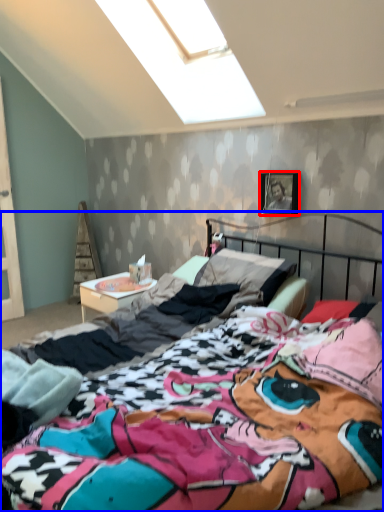
Question: Which point is closer to the camera, picture frame (highlighted by a red box) or bed (highlighted by a blue box)?

Choices:
 (A) picture frame
 (B) bed

Answer: (B)